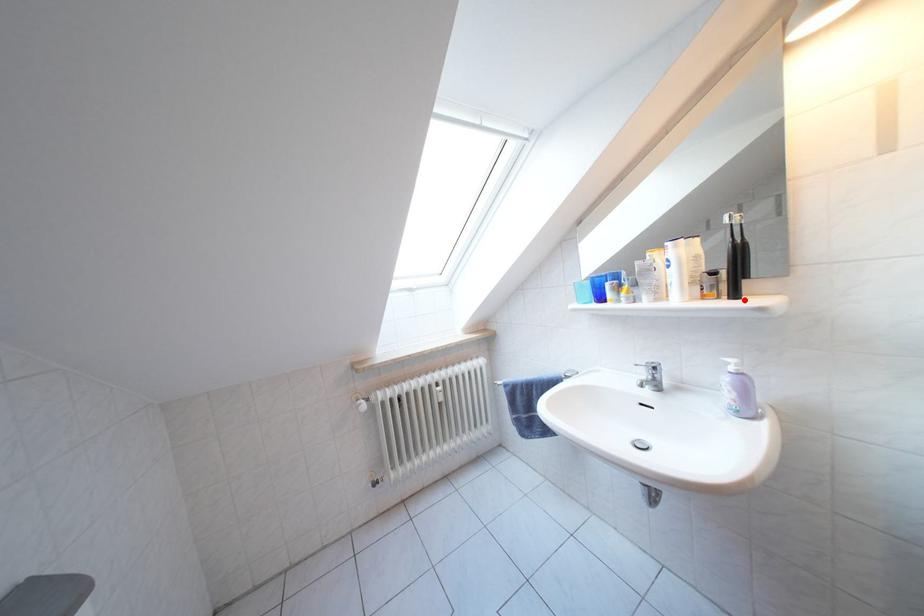
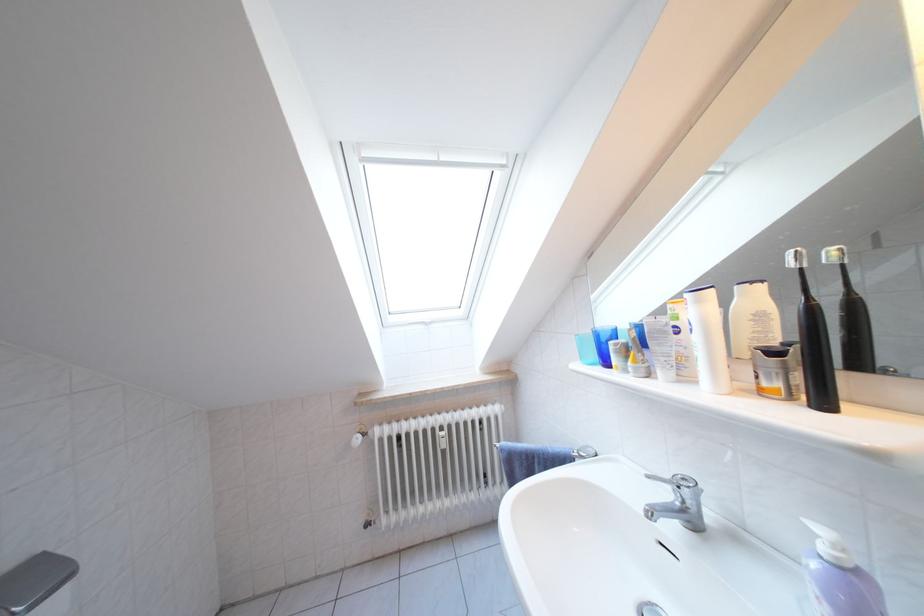
Where in the second image is the point corresponding to the highlighted location from the first image?

(833, 407)